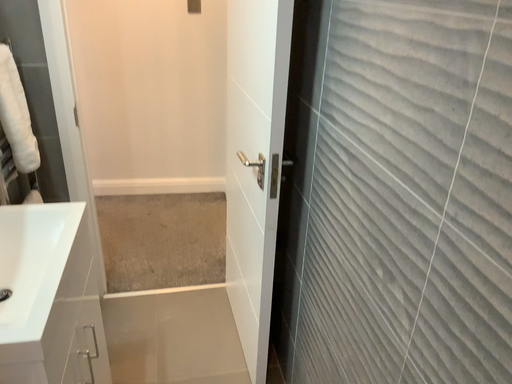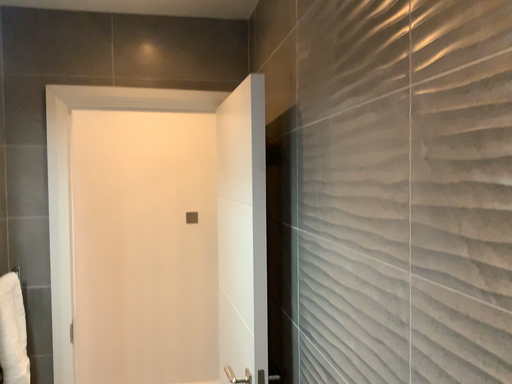
Question: How did the camera likely rotate when shooting the video?

Choices:
 (A) rotated upward
 (B) rotated downward

Answer: (A)